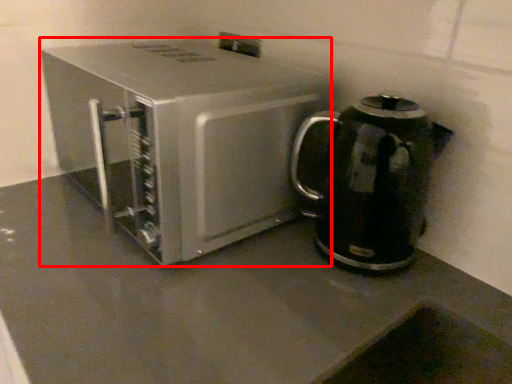
Question: In this image, where is kitchen appliance (annotated by the red box) located relative to kitchen appliance?

Choices:
 (A) right
 (B) left

Answer: (B)